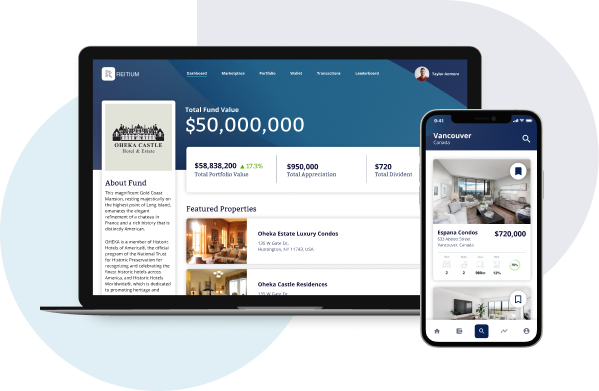
Locate an element on the screen. The image size is (599, 391). photos on laptop screen is located at coordinates (208, 241), (204, 279).